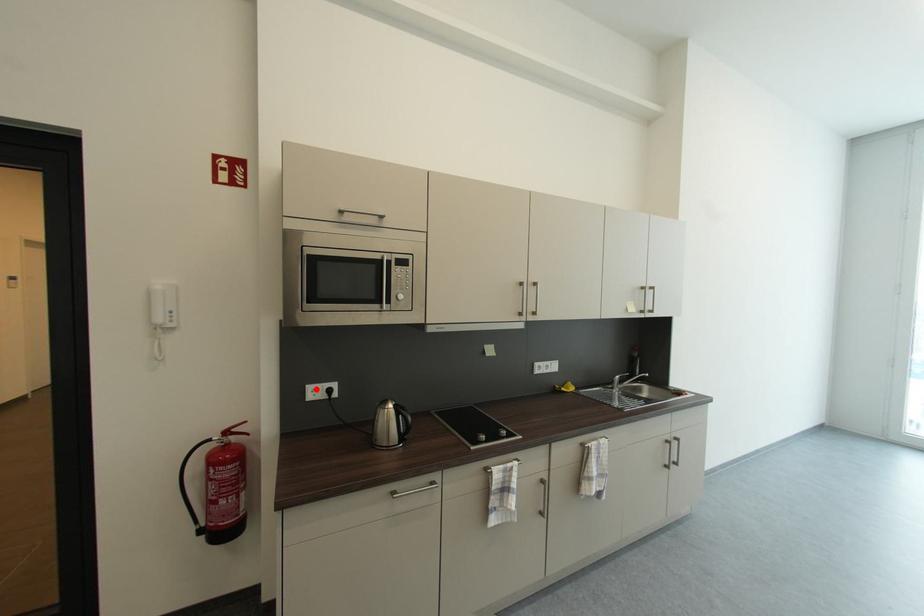
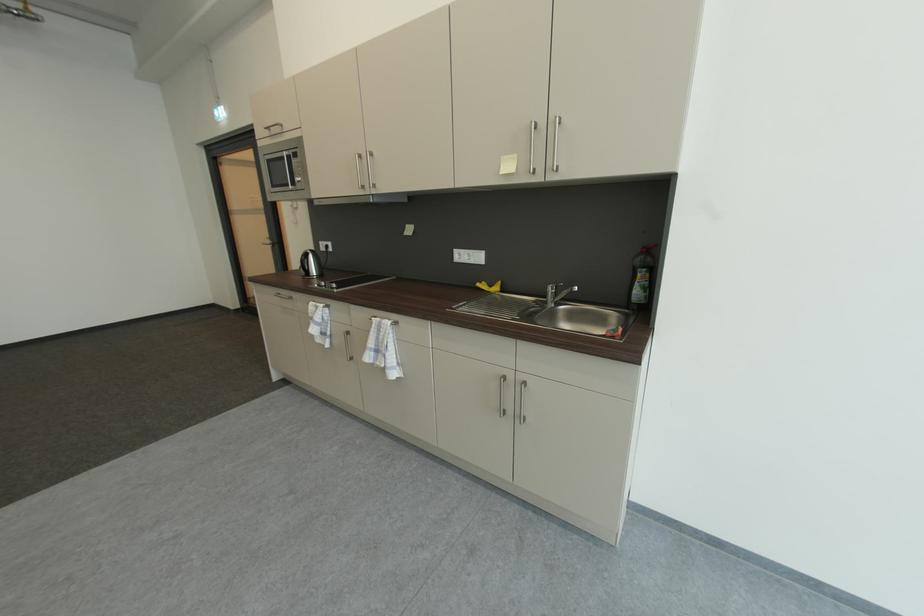
The point at the highlighted location is marked in the first image. Where is the corresponding point in the second image?

(327, 245)